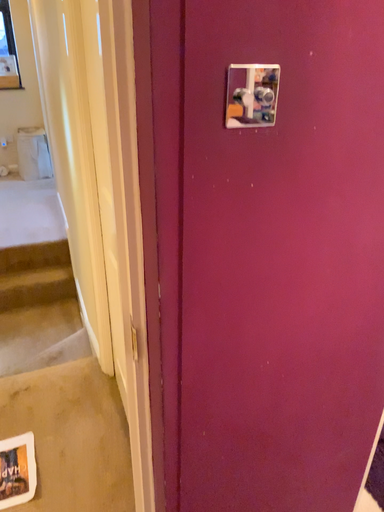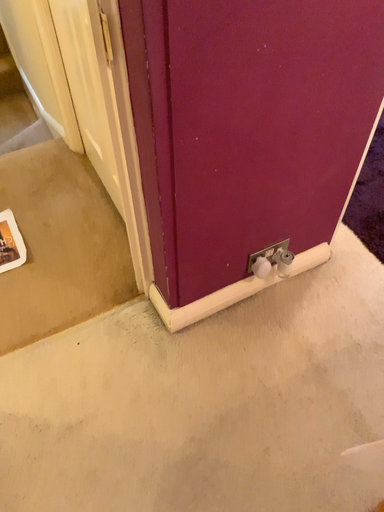
Question: Which way did the camera rotate in the video?

Choices:
 (A) rotated upward
 (B) rotated downward

Answer: (B)